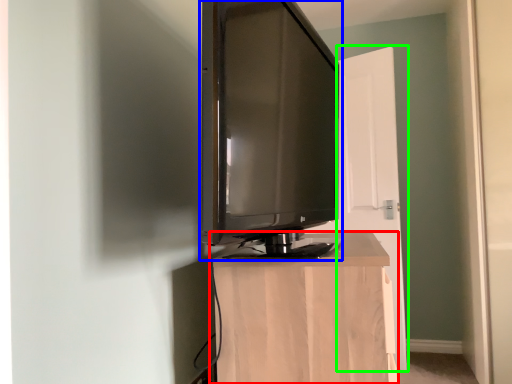
Question: Considering the real-world distances, which object is farthest from furniture (highlighted by a red box)? television (highlighted by a blue box) or door (highlighted by a green box)?

Choices:
 (A) television
 (B) door

Answer: (B)